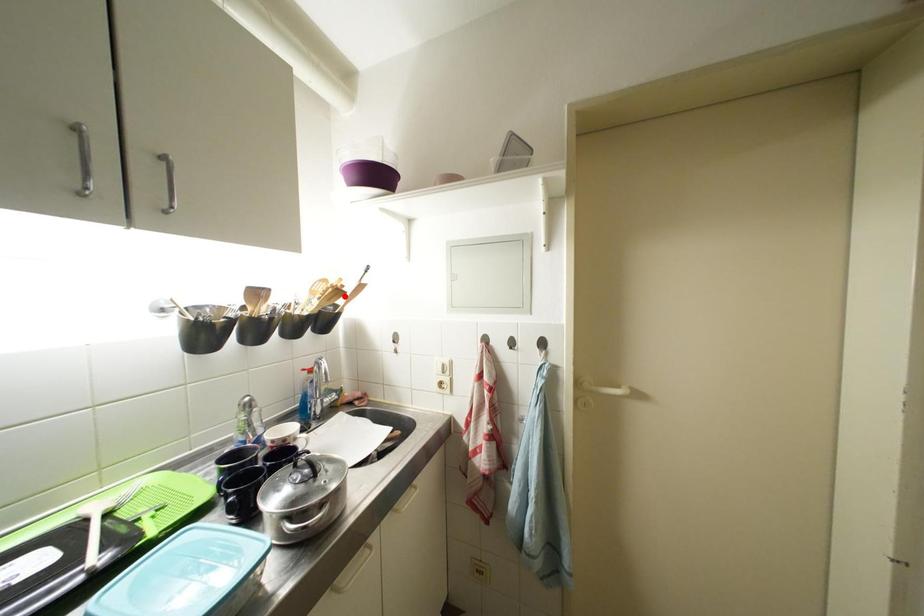
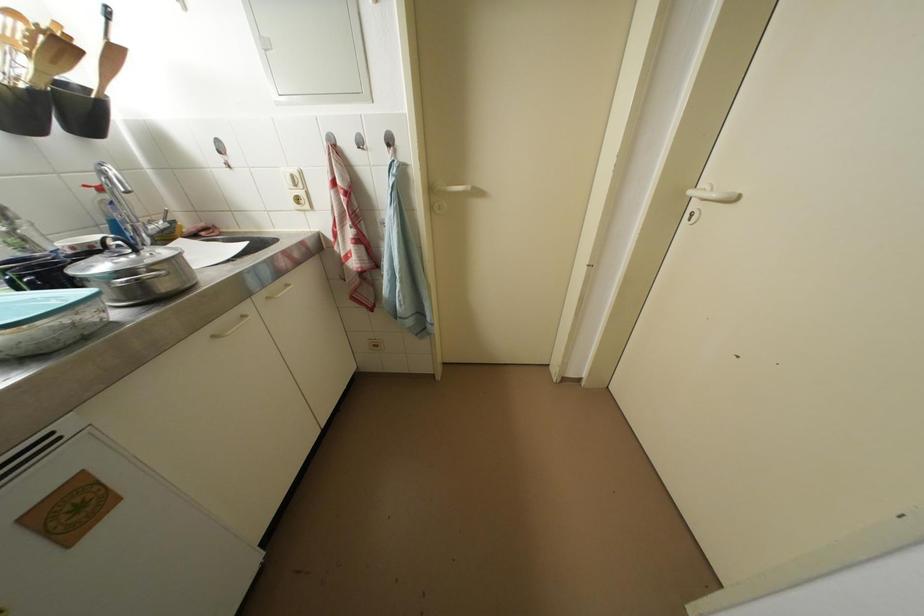
The point at the highlighted location is marked in the first image. Where is the corresponding point in the second image?

(69, 50)